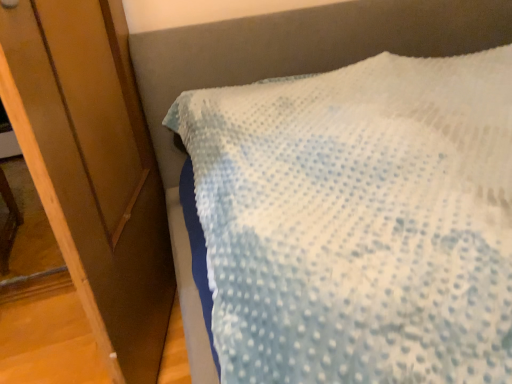
This screenshot has width=512, height=384. I want to click on wooden door at left, so click(x=93, y=169).

What do you see at coordinates (93, 169) in the screenshot? The image size is (512, 384). I see `wooden door at left` at bounding box center [93, 169].

The image size is (512, 384). Identify the location of wooden door at left. (93, 169).